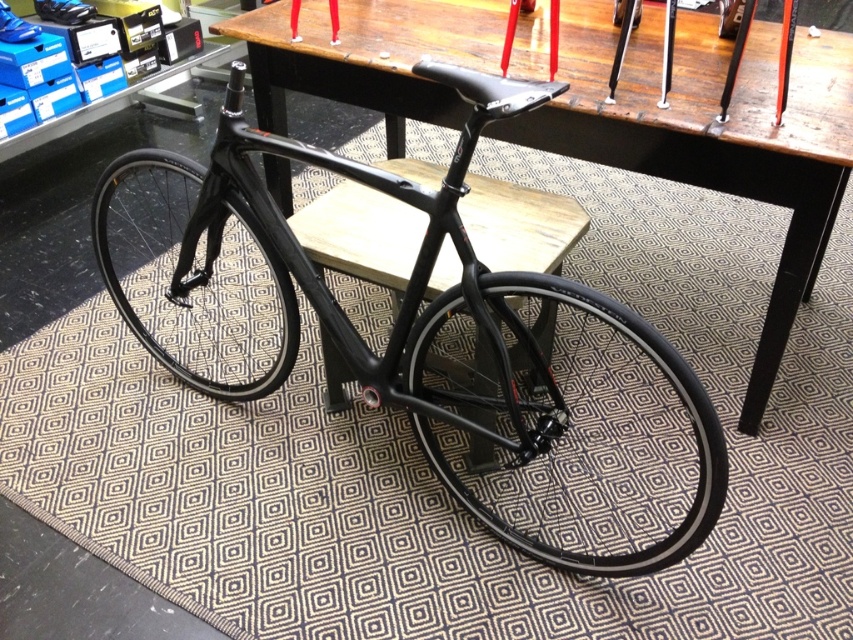
Question: Which of the following is the farthest from the observer?

Choices:
 (A) 543,321
 (B) 485,132

Answer: (A)

Question: Which point is farther to the camera?

Choices:
 (A) black matte bicycle at center
 (B) wooden table at center

Answer: (B)

Question: Is black matte bicycle at center above wooden table at center?

Choices:
 (A) no
 (B) yes

Answer: (A)

Question: Which point is farther to the camera?

Choices:
 (A) (393, 4)
 (B) (108, 196)

Answer: (A)

Question: Can you confirm if black matte bicycle at center is positioned above wooden table at center?

Choices:
 (A) no
 (B) yes

Answer: (A)

Question: In this image, where is black matte bicycle at center located relative to wooden table at center?

Choices:
 (A) below
 (B) above

Answer: (A)